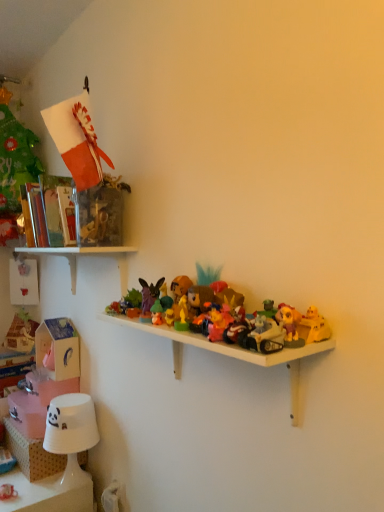
Locate an element on the screen. The width and height of the screenshot is (384, 512). vacant point to the right of smooth white lampshade at lower left, which is counted as the eighth toy, starting from the front is located at coordinates (41, 494).